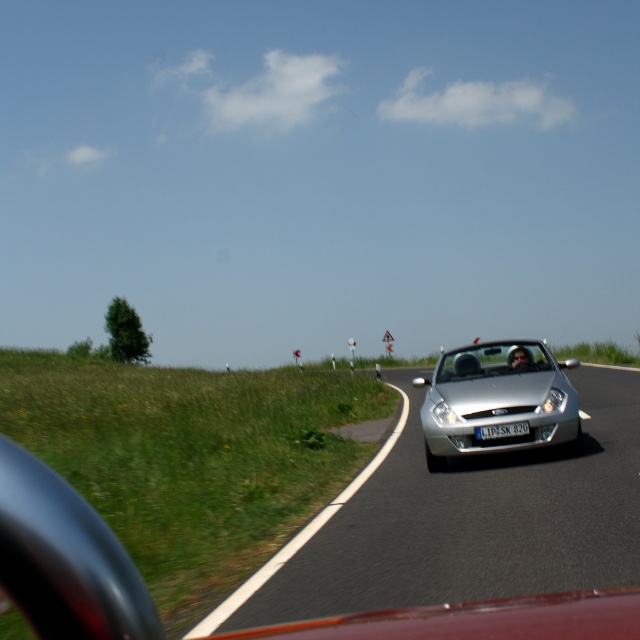
You are a driver in the silver metallic car at center. You want to overtake the silver metallic convertible at center on this road. Which side should you move to in order to safely pass it?

The silver metallic car at center is positioned on the left side of silver metallic convertible at center, so to safely overtake the silver metallic convertible at center, you should move to the right side of the road.

You are a driver in a car behind the red vehicle. You want to overtake the silver convertible car ahead on the curving road. Based on the scene, is the point at coordinate (461, 522) a safe location to start overtaking the silver metallic car at center?

The point at coordinate (461, 522) is where the silver metallic car at center is located. Since overtaking at the location of the car itself would not be safe, you should choose a different point further ahead where the road allows for a safe maneuver.